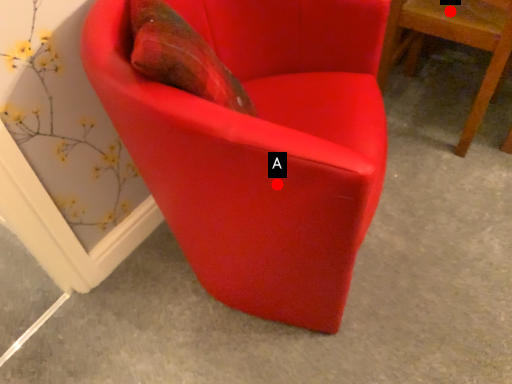
Question: Two points are circled on the image, labeled by A and B beside each circle. Which of the following is the closest to the observer?

Choices:
 (A) A is closer
 (B) B is closer

Answer: (A)